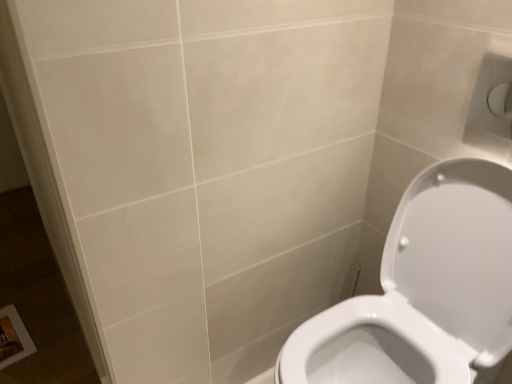
The height and width of the screenshot is (384, 512). What are the coordinates of `white glossy toilet at lower right` in the screenshot? It's located at (424, 290).

What do you see at coordinates (424, 290) in the screenshot?
I see `white glossy toilet at lower right` at bounding box center [424, 290].

What is the approximate width of white glossy toilet at lower right?

The width of white glossy toilet at lower right is 21.75 inches.

The height and width of the screenshot is (384, 512). What are the coordinates of `white glossy toilet at lower right` in the screenshot? It's located at (424, 290).